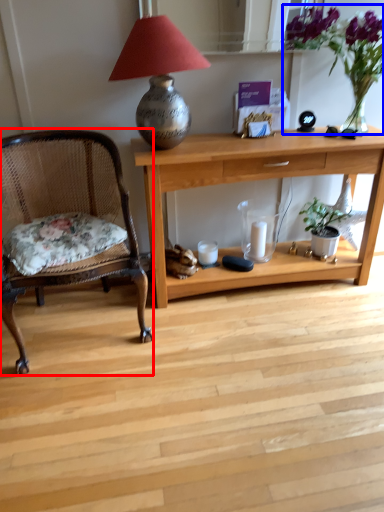
Question: Which point is closer to the camera, chair (highlighted by a red box) or floral arrangement (highlighted by a blue box)?

Choices:
 (A) chair
 (B) floral arrangement

Answer: (A)